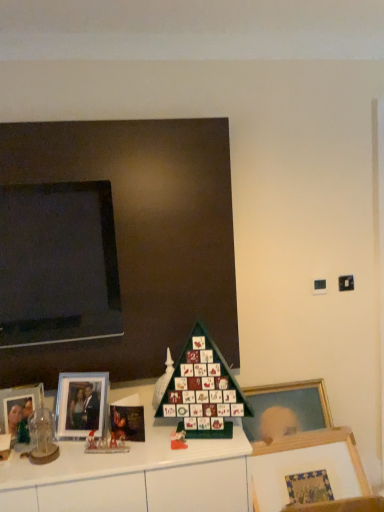
Question: Considering the relative sizes of matte glass picture frame at left, which appears as the second picture frame when viewed from the right, and matte black board at upper left in the image provided, is matte glass picture frame at left, which appears as the second picture frame when viewed from the right, smaller than matte black board at upper left?

Choices:
 (A) yes
 (B) no

Answer: (A)

Question: From the image's perspective, is matte glass picture frame at left, which appears as the second picture frame when viewed from the right, located beneath matte black board at upper left?

Choices:
 (A) yes
 (B) no

Answer: (A)

Question: From a real-world perspective, is matte glass picture frame at left, which appears as the second picture frame when viewed from the right, positioned under matte black board at upper left based on gravity?

Choices:
 (A) no
 (B) yes

Answer: (B)

Question: From the image's perspective, is matte glass picture frame at left, which is the second picture frame from left to right, on top of matte black board at upper left?

Choices:
 (A) yes
 (B) no

Answer: (B)

Question: Can you confirm if matte glass picture frame at left, which appears as the second picture frame when viewed from the right, is shorter than matte black board at upper left?

Choices:
 (A) no
 (B) yes

Answer: (B)

Question: Which is correct: matte glass picture frame at left, acting as the 3th picture frame starting from the right, is inside matte black board at upper left, or outside of it?

Choices:
 (A) inside
 (B) outside

Answer: (B)

Question: Based on their sizes in the image, would you say matte glass picture frame at left, acting as the 3th picture frame starting from the right, is bigger or smaller than matte black board at upper left?

Choices:
 (A) small
 (B) big

Answer: (A)

Question: Considering the relative positions of matte glass picture frame at left, acting as the 3th picture frame starting from the right, and matte black board at upper left in the image provided, is matte glass picture frame at left, acting as the 3th picture frame starting from the right, to the left or to the right of matte black board at upper left?

Choices:
 (A) left
 (B) right

Answer: (A)

Question: Does point tap(13, 394) appear closer or farther from the camera than point tap(178, 284)?

Choices:
 (A) farther
 (B) closer

Answer: (B)

Question: Is matte plastic advent calendar at center, the 2th toy positioned from the front, situated inside clear glass dome at left, arranged as the third toy when viewed from the back, or outside?

Choices:
 (A) outside
 (B) inside

Answer: (A)

Question: Considering the positions of matte plastic advent calendar at center, which ranks as the 1th toy in right-to-left order, and clear glass dome at left, arranged as the 3th toy when viewed from the right, in the image, is matte plastic advent calendar at center, which ranks as the 1th toy in right-to-left order, wider or thinner than clear glass dome at left, arranged as the 3th toy when viewed from the right,?

Choices:
 (A) thin
 (B) wide

Answer: (A)

Question: From a real-world perspective, is matte plastic advent calendar at center, which ranks as the 1th toy in right-to-left order, above or below clear glass dome at left, arranged as the 3th toy when viewed from the right?

Choices:
 (A) above
 (B) below

Answer: (B)

Question: In the image, is matte plastic advent calendar at center, the 2th toy positioned from the front, on the left side or the right side of clear glass dome at left, which appears as the 1th toy when viewed from the front?

Choices:
 (A) right
 (B) left

Answer: (A)

Question: From their relative heights in the image, would you say matte black board at upper left is taller or shorter than matte plastic advent calendar at center, the second toy viewed from the back?

Choices:
 (A) tall
 (B) short

Answer: (A)

Question: From the image's perspective, is matte black board at upper left located above or below matte plastic advent calendar at center, which ranks as the 1th toy in right-to-left order?

Choices:
 (A) below
 (B) above

Answer: (B)